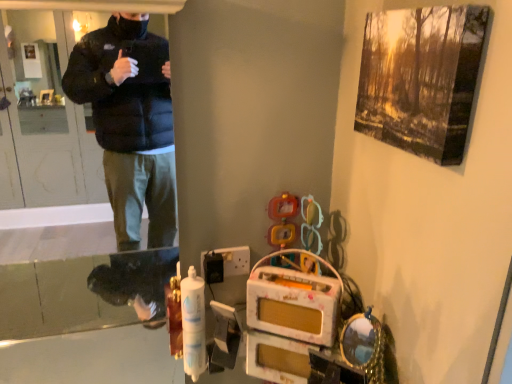
Where is `transparent plastic screen door at left`? Image resolution: width=512 pixels, height=384 pixels. transparent plastic screen door at left is located at coordinates (82, 290).

Describe the element at coordinates (82, 290) in the screenshot. The width and height of the screenshot is (512, 384). I see `transparent plastic screen door at left` at that location.

Locate an element on the screen. This screenshot has width=512, height=384. black plastic switch at lower center is located at coordinates (234, 260).

What is the approximate height of black plastic switch at lower center?

It is 3.55 inches.

This screenshot has width=512, height=384. What do you see at coordinates (234, 260) in the screenshot? I see `black plastic switch at lower center` at bounding box center [234, 260].

What are the coordinates of `transparent plastic screen door at left` in the screenshot? It's located at (82, 290).

Which object is positioned more to the right, transparent plastic screen door at left or black plastic switch at lower center?

black plastic switch at lower center.

Considering the relative positions of transparent plastic screen door at left and black plastic switch at lower center in the image provided, is transparent plastic screen door at left in front of black plastic switch at lower center?

Yes, transparent plastic screen door at left is closer to the camera.

Is point (150, 16) closer or farther from the camera than point (232, 257)?

Point (150, 16) is farther from the camera than point (232, 257).

From the picture: From the image's perspective, is transparent plastic screen door at left located above or below black plastic switch at lower center?

From the image's perspective, transparent plastic screen door at left appears above black plastic switch at lower center.

From a real-world perspective, which object rests below the other?

From a 3D spatial view, black plastic switch at lower center is below.

Considering the sizes of objects transparent plastic screen door at left and black plastic switch at lower center in the image provided, who is wider, transparent plastic screen door at left or black plastic switch at lower center?

transparent plastic screen door at left is wider.

Does transparent plastic screen door at left have a greater height compared to black plastic switch at lower center?

Yes.

Considering the relative sizes of transparent plastic screen door at left and black plastic switch at lower center in the image provided, is transparent plastic screen door at left bigger than black plastic switch at lower center?

Indeed, transparent plastic screen door at left has a larger size compared to black plastic switch at lower center.

Is transparent plastic screen door at left not within black plastic switch at lower center?

Absolutely, transparent plastic screen door at left is external to black plastic switch at lower center.

Is transparent plastic screen door at left with black plastic switch at lower center?

They are not placed beside each other.

Could you tell me if transparent plastic screen door at left is turned towards black plastic switch at lower center?

No, transparent plastic screen door at left is not aimed at black plastic switch at lower center.

What's the angular difference between transparent plastic screen door at left and black plastic switch at lower center's facing directions?

The angle between the facing direction of transparent plastic screen door at left and the facing direction of black plastic switch at lower center is 0.677 degrees.

Image resolution: width=512 pixels, height=384 pixels. I want to click on screen door above the black plastic switch at lower center (from the image's perspective), so click(x=82, y=290).

Between black plastic switch at lower center and transparent plastic screen door at left, which one appears on the left side from the viewer's perspective?

Positioned to the left is transparent plastic screen door at left.

Considering the relative positions of black plastic switch at lower center and transparent plastic screen door at left in the image provided, is black plastic switch at lower center in front of transparent plastic screen door at left?

That is False.

Which point is more forward, (229, 268) or (141, 261)?

The point (229, 268) is more forward.

From the image's perspective, does black plastic switch at lower center appear higher than transparent plastic screen door at left?

No, from the image's perspective, black plastic switch at lower center is not above transparent plastic screen door at left.

From a real-world perspective, which is physically above, black plastic switch at lower center or transparent plastic screen door at left?

transparent plastic screen door at left is physically above.

Which of these two, black plastic switch at lower center or transparent plastic screen door at left, is thinner?

black plastic switch at lower center.

Can you confirm if black plastic switch at lower center is shorter than transparent plastic screen door at left?

Correct, black plastic switch at lower center is not as tall as transparent plastic screen door at left.

Who is smaller, black plastic switch at lower center or transparent plastic screen door at left?

With smaller size is black plastic switch at lower center.

Is black plastic switch at lower center not within transparent plastic screen door at left?

Yes, black plastic switch at lower center is not within transparent plastic screen door at left.

Would you consider black plastic switch at lower center to be distant from transparent plastic screen door at left?

Yes.

Is black plastic switch at lower center turned away from transparent plastic screen door at left?

That's not correct — black plastic switch at lower center is not looking away from transparent plastic screen door at left.

Image resolution: width=512 pixels, height=384 pixels. In order to click on switch below the transparent plastic screen door at left (from the image's perspective) in this screenshot , I will do `click(234, 260)`.

Image resolution: width=512 pixels, height=384 pixels. Identify the location of screen door above the black plastic switch at lower center (from a real-world perspective). (82, 290).

Where is `screen door above the black plastic switch at lower center (from the image's perspective)`? screen door above the black plastic switch at lower center (from the image's perspective) is located at coordinates pos(82,290).